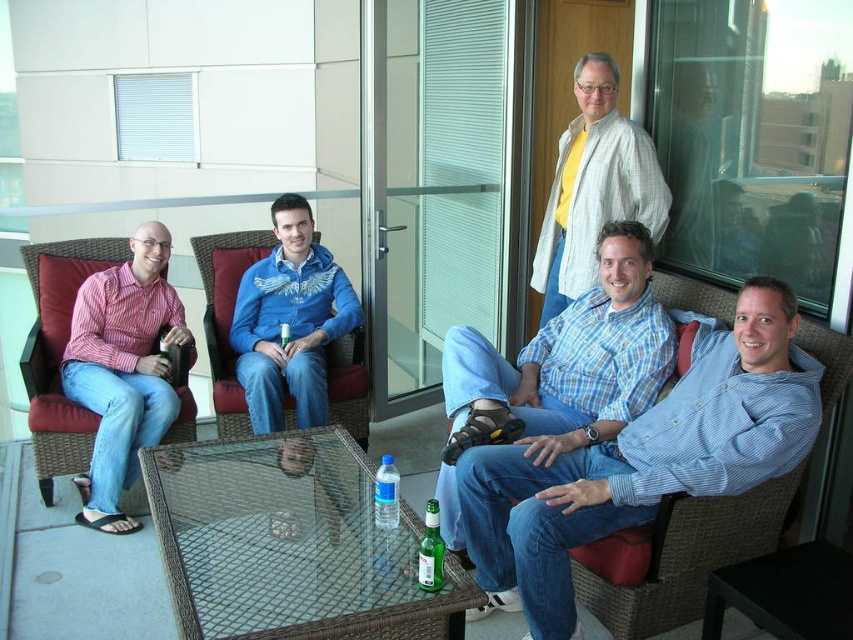
Question: Considering the relative positions of green glass bottle at center and clear plastic water bottle at center in the image provided, where is green glass bottle at center located with respect to clear plastic water bottle at center?

Choices:
 (A) left
 (B) right

Answer: (B)

Question: Which point appears farthest from the camera in this image?

Choices:
 (A) (573, 83)
 (B) (523, 381)
 (C) (312, 310)
 (D) (436, 586)

Answer: (C)

Question: Which object appears closest to the camera in this image?

Choices:
 (A) blue fleece jacket at center
 (B) light gray textured shirt at upper center
 (C) green glass bottle at center
 (D) matte pink shirt at left

Answer: (C)

Question: Considering the relative positions of blue fleece jacket at center and clear plastic water bottle at center in the image provided, where is blue fleece jacket at center located with respect to clear plastic water bottle at center?

Choices:
 (A) right
 (B) left

Answer: (B)

Question: Is blue fleece jacket at center to the right of green glass bottle at center from the viewer's perspective?

Choices:
 (A) yes
 (B) no

Answer: (B)

Question: Which point appears closest to the camera in this image?

Choices:
 (A) (310, 285)
 (B) (717, 492)
 (C) (469, 401)
 (D) (154, 262)

Answer: (B)